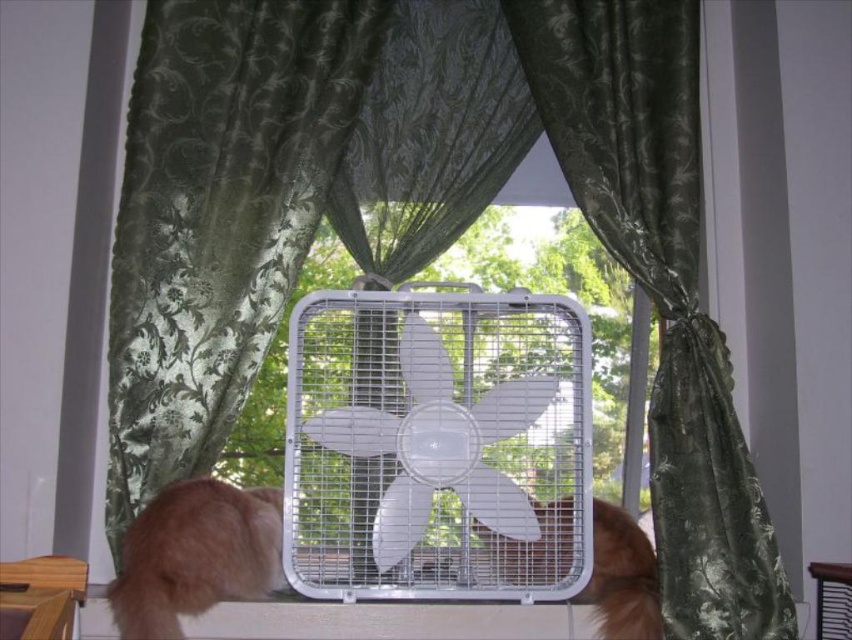
Does white plastic fan at center have a greater width compared to brown furry cat at center?

Correct, the width of white plastic fan at center exceeds that of brown furry cat at center.

You are a GUI agent. You are given a task and a screenshot of the screen. Output one action in this format:
    pyautogui.click(x=<x>, y=<y>)
    Task: Click on the white plastic fan at center
    This screenshot has width=852, height=640.
    Given the screenshot: What is the action you would take?
    pyautogui.click(x=433, y=442)

Is point (445, 420) positioned before point (602, 620)?

No, it is behind (602, 620).

Identify the location of white plastic fan at center. point(433,442).

Is point (306, 593) positioned in front of point (654, 26)?

Yes, point (306, 593) is closer to viewer.

Does white plastic fan at center come in front of green satin curtain at center?

No.

Between point (571, 449) and point (684, 205), which one is positioned in front?

Point (571, 449)

Where is `white plastic fan at center`? The height and width of the screenshot is (640, 852). white plastic fan at center is located at coordinates (433, 442).

Is fluffy orange fur at lower left wider than brown furry cat at center?

No.

Does fluffy orange fur at lower left appear on the left side of brown furry cat at center?

Yes, fluffy orange fur at lower left is to the left of brown furry cat at center.

The height and width of the screenshot is (640, 852). In order to click on fluffy orange fur at lower left in this screenshot , I will do `click(194, 556)`.